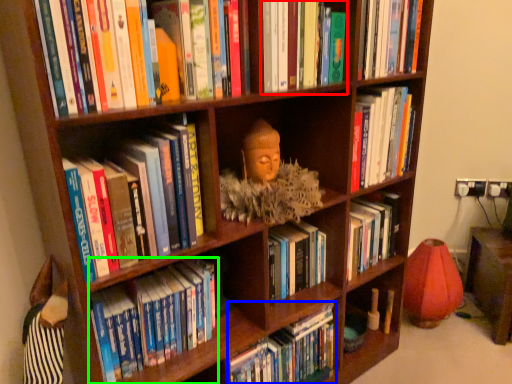
Question: Which object is positioned closest to book (highlighted by a red box)? Select from book (highlighted by a blue box) and book (highlighted by a green box).

Choices:
 (A) book
 (B) book

Answer: (B)